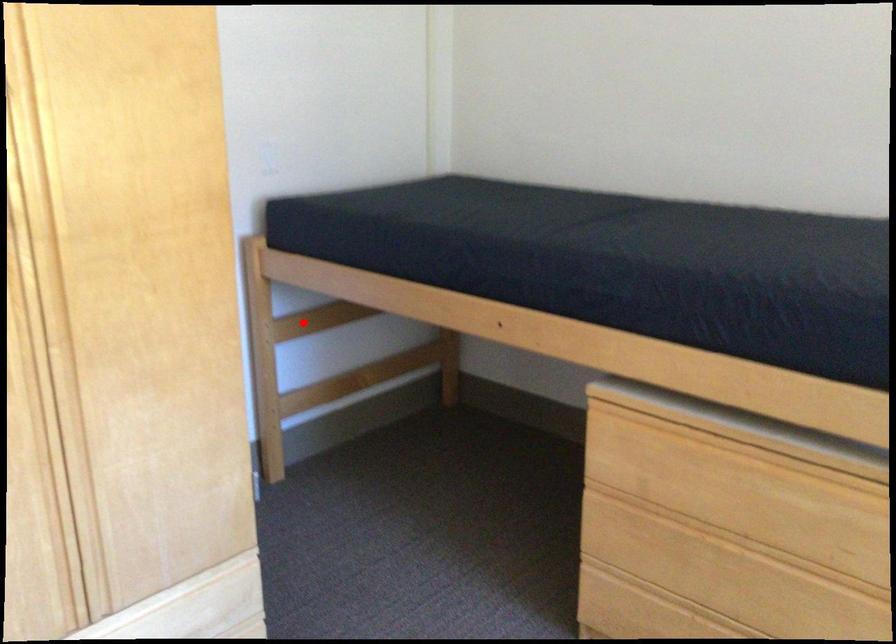
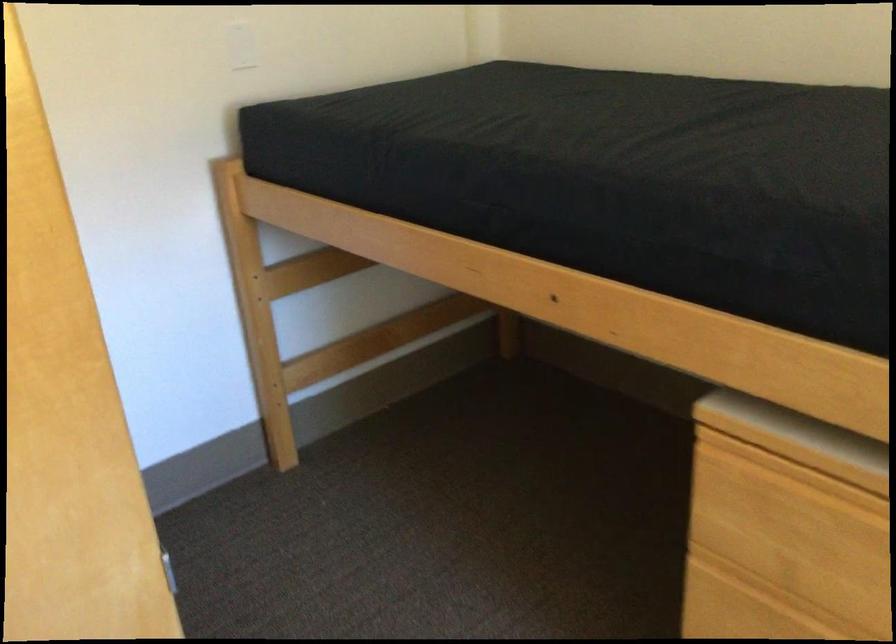
Question: I am providing you with two images of the same scene from different viewpoints. A red point is shown in image1. For the corresponding object point in image2, is it positioned nearer or farther from the camera?

Choices:
 (A) Nearer
 (B) Farther

Answer: (A)